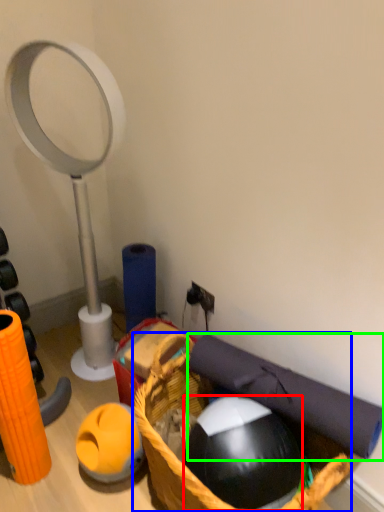
Question: Based on their relative distances, which object is nearer to ball (highlighted by a red box)? Choose from basket (highlighted by a blue box) and yoga mat (highlighted by a green box).

Choices:
 (A) basket
 (B) yoga mat

Answer: (A)